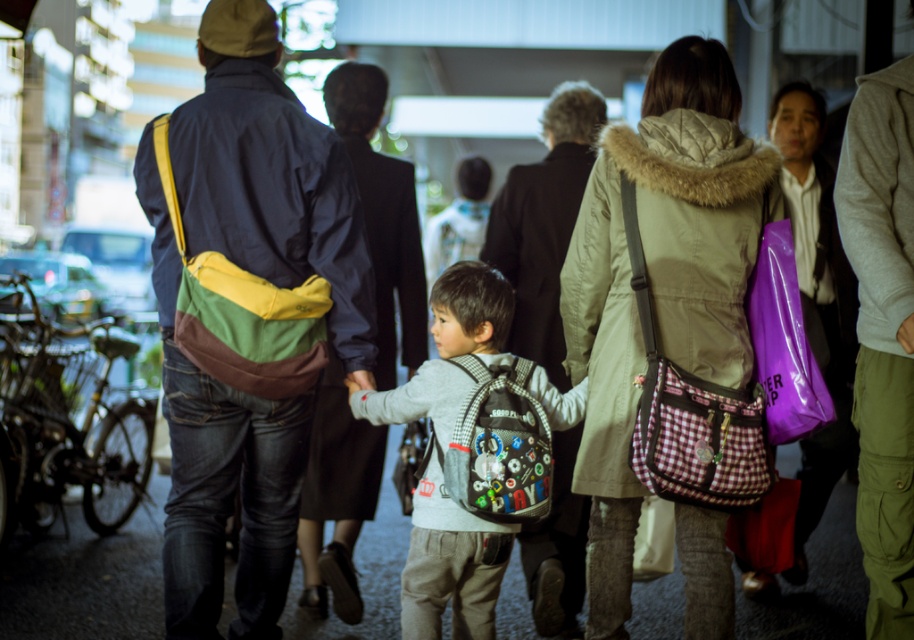
Can you confirm if multicolored fabric bag at left is positioned to the left of gray fabric backpack at center?

Indeed, multicolored fabric bag at left is positioned on the left side of gray fabric backpack at center.

Is multicolored fabric bag at left to the right of gray fabric backpack at center from the viewer's perspective?

In fact, multicolored fabric bag at left is to the left of gray fabric backpack at center.

Locate an element on the screen. The image size is (914, 640). multicolored fabric bag at left is located at coordinates (246, 314).

Does matte black jacket at center lie in front of light brown leather jacket at right?

No, it is not.

Is point (540, 285) positioned after point (843, 358)?

No.

In order to click on matte black jacket at center in this screenshot , I will do `click(544, 224)`.

Does gray fabric backpack at center have a greater width compared to dark blue jacket at center?

Correct, the width of gray fabric backpack at center exceeds that of dark blue jacket at center.

The height and width of the screenshot is (640, 914). I want to click on gray fabric backpack at center, so click(470, 452).

Locate an element on the screen. gray fabric backpack at center is located at coordinates (x=470, y=452).